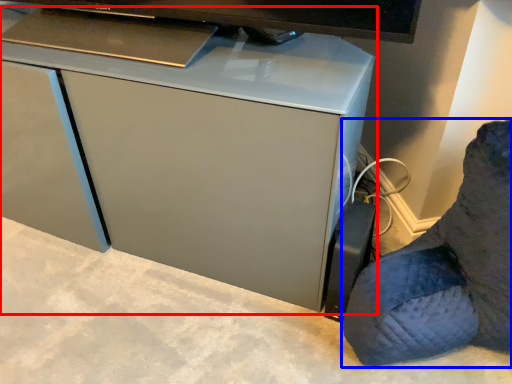
Question: Which object is closer to the camera taking this photo, computer desk (highlighted by a red box) or furniture (highlighted by a blue box)?

Choices:
 (A) computer desk
 (B) furniture

Answer: (B)